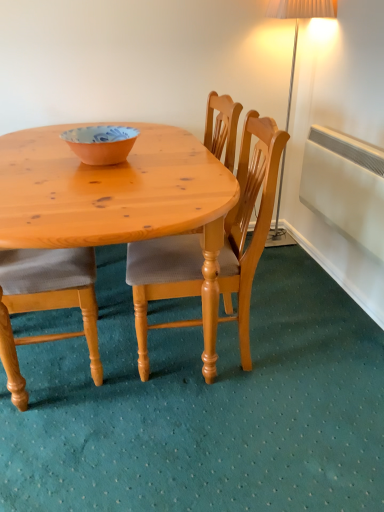
Question: Considering the relative sizes of light brown wooden chair at center and white plastic radiator at right in the image provided, is light brown wooden chair at center taller than white plastic radiator at right?

Choices:
 (A) no
 (B) yes

Answer: (B)

Question: Can you confirm if light brown wooden chair at center is thinner than white plastic radiator at right?

Choices:
 (A) yes
 (B) no

Answer: (B)

Question: Is light brown wooden chair at center facing towards white plastic radiator at right?

Choices:
 (A) yes
 (B) no

Answer: (B)

Question: Would you say light brown wooden chair at center is a long distance from white plastic radiator at right?

Choices:
 (A) yes
 (B) no

Answer: (B)

Question: From the image's perspective, would you say light brown wooden chair at center is positioned over white plastic radiator at right?

Choices:
 (A) no
 (B) yes

Answer: (A)

Question: Is light brown wooden chair at center turned away from white plastic radiator at right?

Choices:
 (A) no
 (B) yes

Answer: (B)

Question: From a real-world perspective, is matte orange bowl at center positioned under white plastic radiator at right based on gravity?

Choices:
 (A) yes
 (B) no

Answer: (B)

Question: Is matte orange bowl at center positioned before white plastic radiator at right?

Choices:
 (A) yes
 (B) no

Answer: (A)

Question: Does matte orange bowl at center come behind white plastic radiator at right?

Choices:
 (A) no
 (B) yes

Answer: (A)

Question: Can you confirm if matte orange bowl at center is positioned to the right of white plastic radiator at right?

Choices:
 (A) yes
 (B) no

Answer: (B)

Question: Can you confirm if matte orange bowl at center is smaller than white plastic radiator at right?

Choices:
 (A) no
 (B) yes

Answer: (B)

Question: Can you confirm if matte orange bowl at center is taller than white plastic radiator at right?

Choices:
 (A) no
 (B) yes

Answer: (A)

Question: Is light brown wooden chair at center located outside matte orange bowl at center?

Choices:
 (A) no
 (B) yes

Answer: (B)